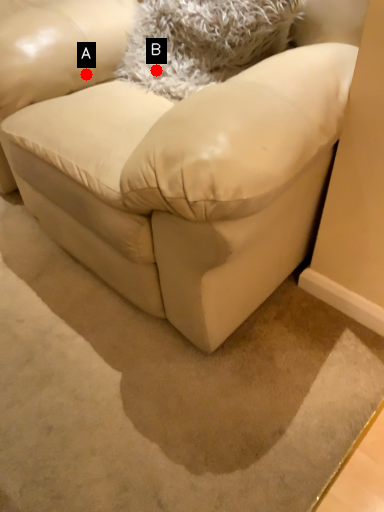
Question: Two points are circled on the image, labeled by A and B beside each circle. Which point appears closest to the camera in this image?

Choices:
 (A) A is closer
 (B) B is closer

Answer: (B)